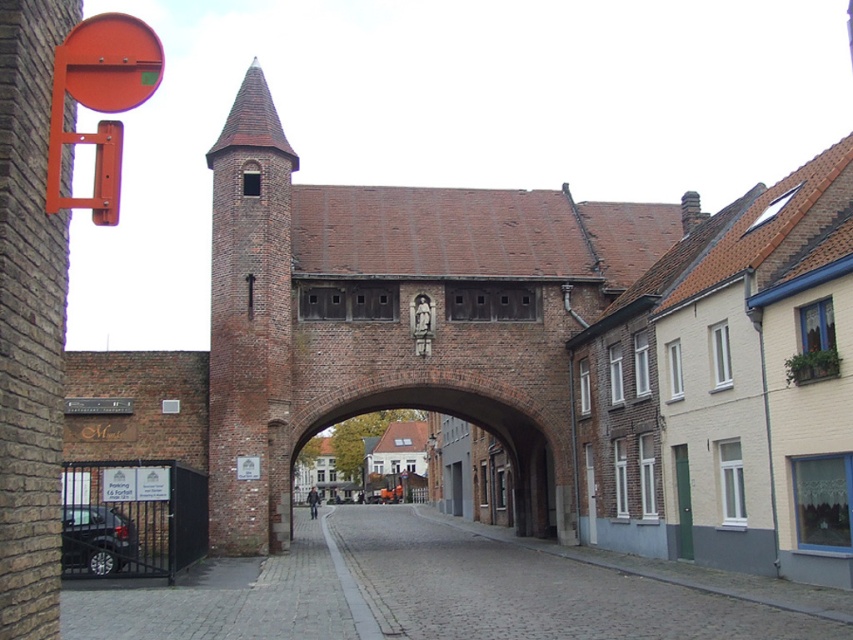
Question: Among these objects, which one is farthest from the camera?

Choices:
 (A) brick archway at center
 (B) orange painted metal sign at upper left

Answer: (A)

Question: Which of these objects is positioned farthest from the brick archway at center?

Choices:
 (A) cobblestone alley at lower left
 (B) orange painted metal sign at upper left
 (C) brown brick tower at center-left

Answer: (B)

Question: Which of the following is the farthest from the observer?

Choices:
 (A) brick archway at center
 (B) cobblestone alley at lower left
 (C) orange painted metal sign at upper left
 (D) brown brick tower at center-left

Answer: (A)

Question: Is brown brick tower at center-left smaller than orange painted metal sign at upper left?

Choices:
 (A) yes
 (B) no

Answer: (B)

Question: Can you confirm if brown brick tower at center-left is bigger than brick archway at center?

Choices:
 (A) no
 (B) yes

Answer: (A)

Question: Is cobblestone alley at lower left wider than brick archway at center?

Choices:
 (A) yes
 (B) no

Answer: (A)